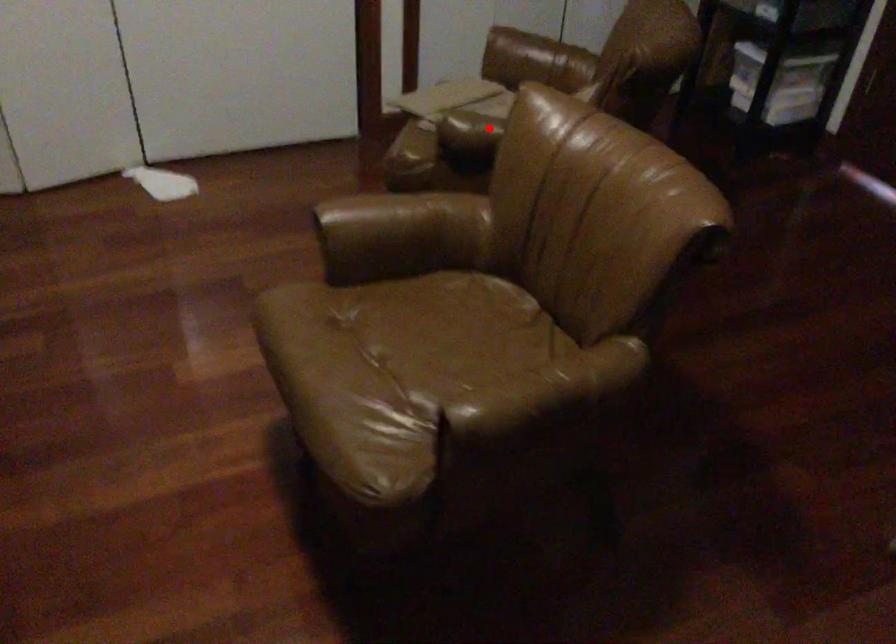
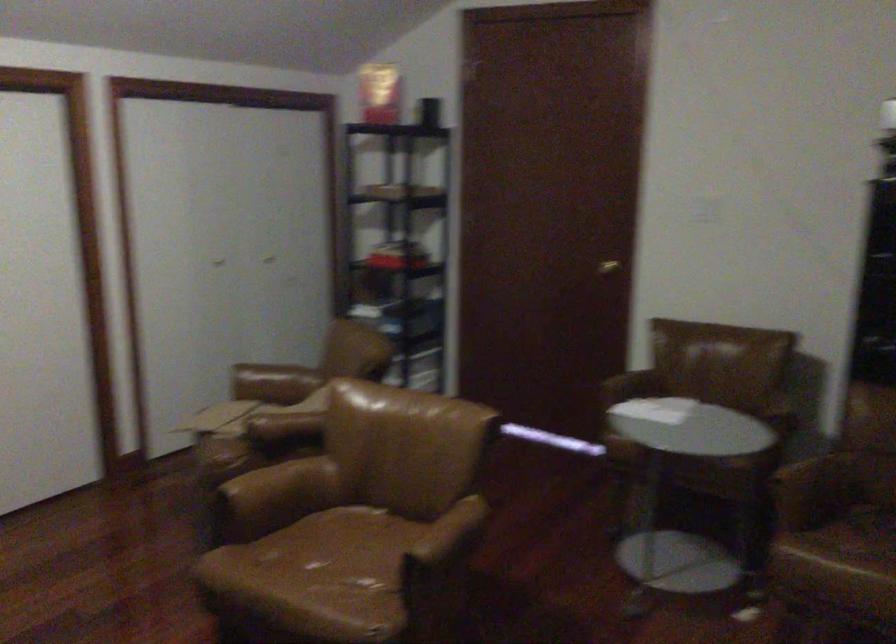
In the second image, find the point that corresponds to the highlighted location in the first image.

(283, 426)